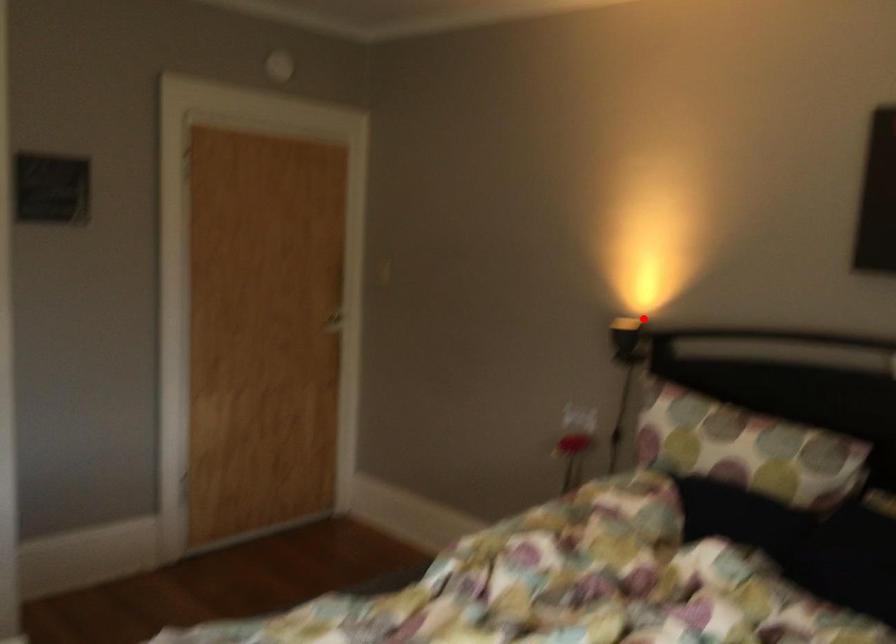
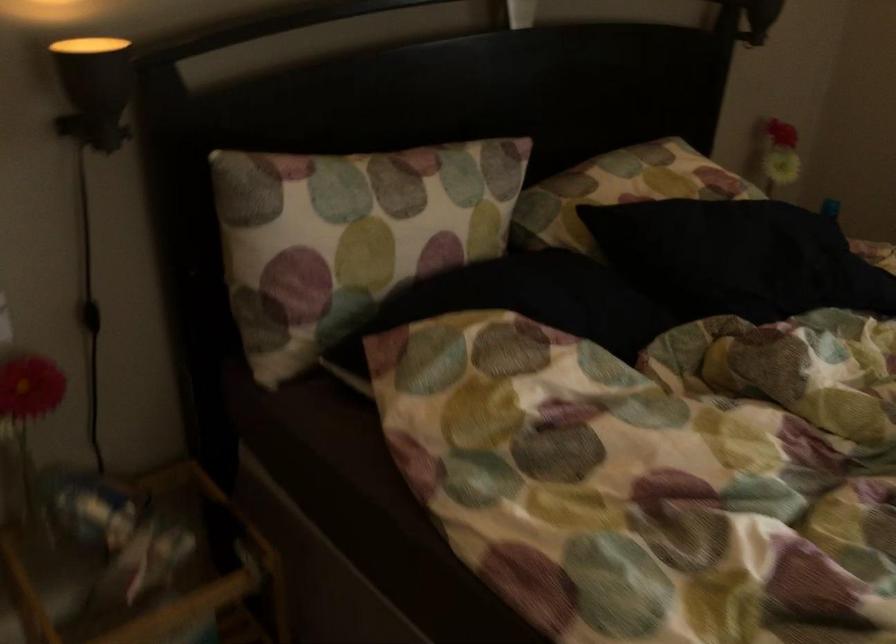
In the second image, find the point that corresponds to the highlighted location in the first image.

(90, 48)